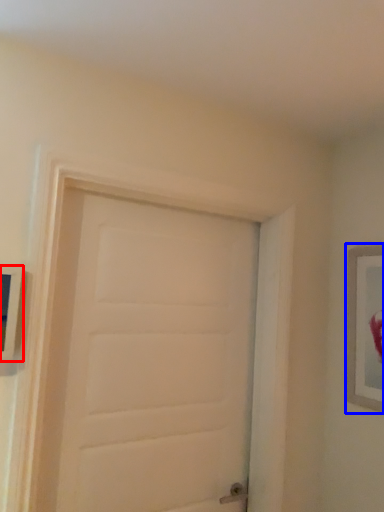
Question: Which of the following is the farthest to the observer, picture frame (highlighted by a red box) or picture frame (highlighted by a blue box)?

Choices:
 (A) picture frame
 (B) picture frame

Answer: (B)